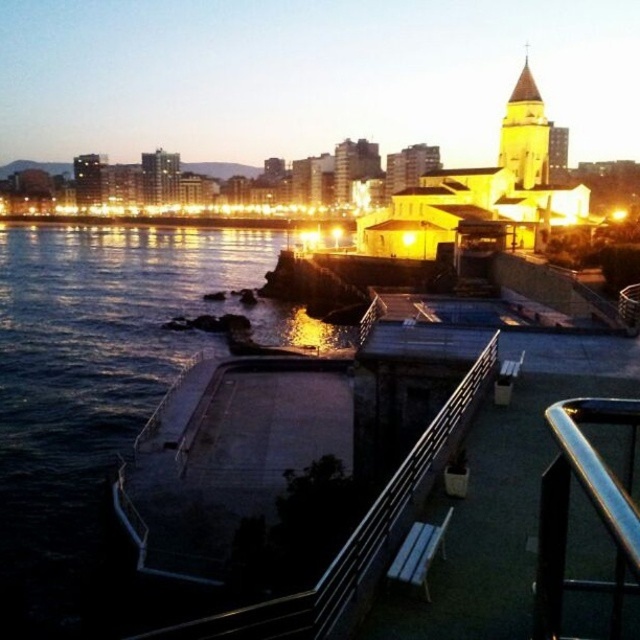
Question: Is the position of metallic silver rail at center less distant than that of golden stone tower at upper right?

Choices:
 (A) yes
 (B) no

Answer: (A)

Question: Which point is farther to the camera?

Choices:
 (A) (493, 333)
 (B) (410, 582)
 (C) (124, 576)

Answer: (A)

Question: Which is nearer to the dark blue water at lower left?

Choices:
 (A) golden stone tower at upper right
 (B) metallic silver rail at center
 (C) metallic silver bench at lower center

Answer: (C)

Question: Which is farther from the dark blue water at lower left?

Choices:
 (A) metallic silver bench at lower center
 (B) metallic silver rail at center
 (C) golden stone tower at upper right

Answer: (C)

Question: Is dark blue water at lower left further to the viewer compared to golden stone tower at upper right?

Choices:
 (A) yes
 (B) no

Answer: (B)

Question: Can you confirm if golden stone tower at upper right is positioned to the left of metallic silver bench at lower center?

Choices:
 (A) no
 (B) yes

Answer: (A)